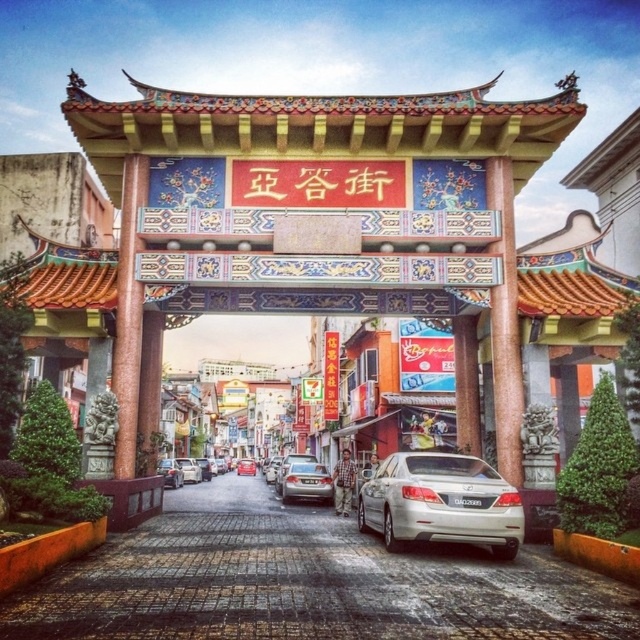
You are a tourist standing at the entrance of the street and see both the silver metallic car at center and the metallic silver sedan at center. Which one is positioned to the left?

The silver metallic car at center is positioned to the left of the metallic silver sedan at center.